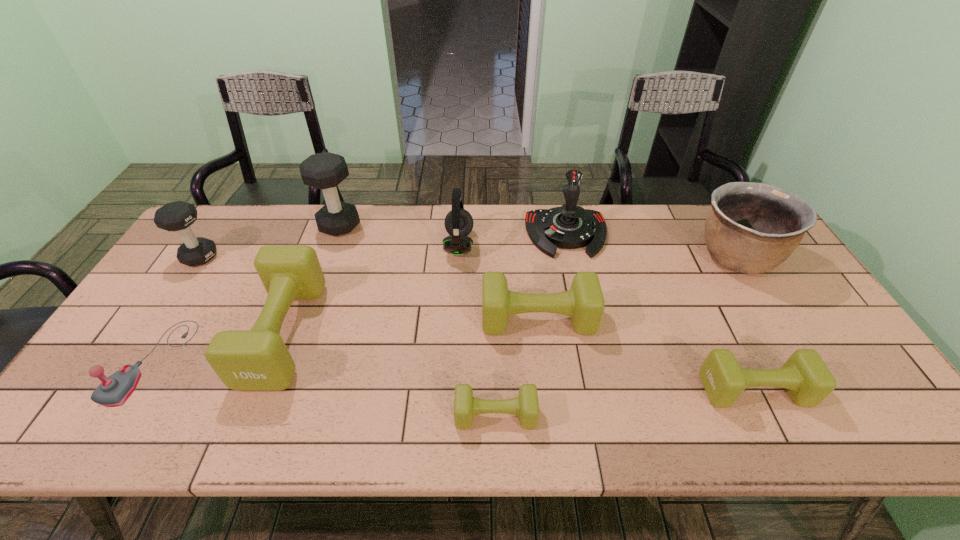
This screenshot has width=960, height=540. What are the coordinates of `the farthest dumbbell` in the screenshot? It's located at (326, 170).

Identify the location of the farther gray dumbbell. The height and width of the screenshot is (540, 960). (326, 170).

Locate an element on the screen. The image size is (960, 540). the taller joystick is located at coordinates (570, 226).

Find the location of a particular element. This screenshot has width=960, height=540. the right joystick is located at coordinates [570, 226].

The width and height of the screenshot is (960, 540). What are the coordinates of `pottery` in the screenshot? It's located at (751, 228).

The height and width of the screenshot is (540, 960). I want to click on headset, so point(458,222).

Find the location of `the fifth nearest dumbbell`. the fifth nearest dumbbell is located at coordinates (177, 216).

This screenshot has width=960, height=540. What are the coordinates of `the leftmost dumbbell` in the screenshot? It's located at (177, 216).

At what (x,y) coordinates should I click in order to perform the action: click on the fourth shortest dumbbell. Please return your answer as a coordinate pair (x, y). This screenshot has height=540, width=960. Looking at the image, I should click on (257, 359).

At what (x,y) coordinates should I click in order to perform the action: click on the biggest olive dumbbell. Please return your answer as a coordinate pair (x, y). Image resolution: width=960 pixels, height=540 pixels. Looking at the image, I should click on (257, 359).